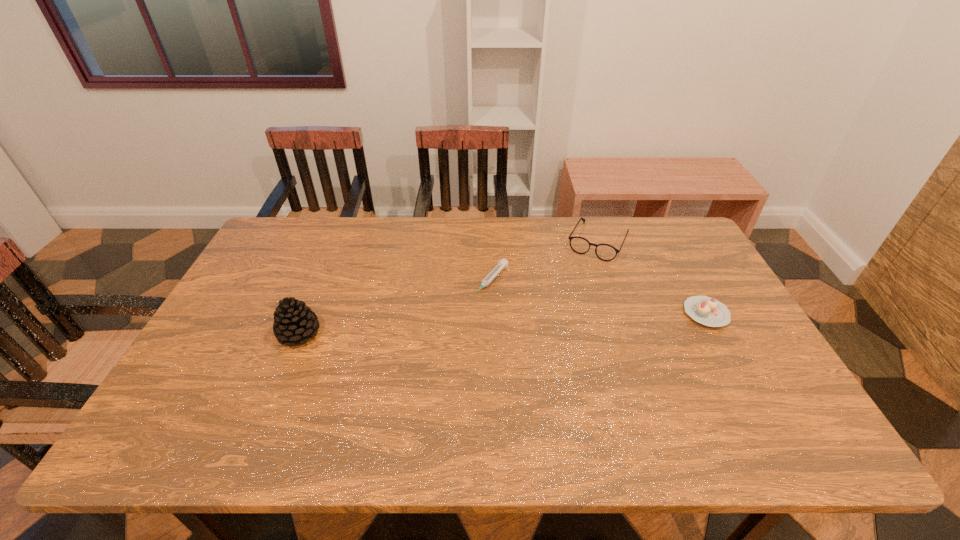
Identify the location of the leftmost object. (294, 322).

Find the location of a particular element. The image size is (960, 540). pinecone is located at coordinates 294,322.

Find the location of a particular element. cupcake is located at coordinates (708, 311).

Find the location of `the rightmost object`. the rightmost object is located at coordinates (708, 311).

I want to click on the shortest object, so click(502, 263).

This screenshot has height=540, width=960. Find the location of `the third object from right to left`. the third object from right to left is located at coordinates (502, 263).

The image size is (960, 540). I want to click on the third shortest object, so click(605, 252).

Identify the location of spectacles. This screenshot has width=960, height=540. (605, 252).

Image resolution: width=960 pixels, height=540 pixels. Identify the location of vacant area located at the narrow end of the tallest object. (286, 365).

Where is `free space located on the back of the rightmost object`? free space located on the back of the rightmost object is located at coordinates (671, 249).